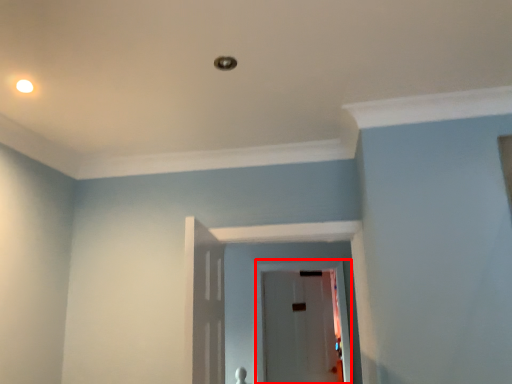
Question: Considering the relative positions of glass door (annotated by the red box) and lighting in the image provided, where is glass door (annotated by the red box) located with respect to the staircase?

Choices:
 (A) left
 (B) right

Answer: (B)